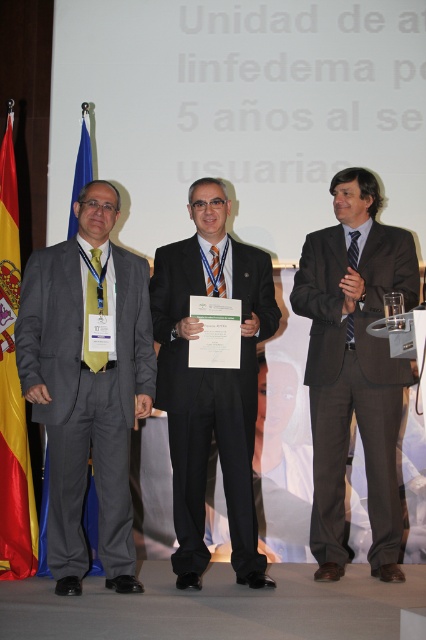
Question: Is matte gray suit at left positioned at the back of red fabric flag at left?

Choices:
 (A) yes
 (B) no

Answer: (B)

Question: Which point is closer to the camera?

Choices:
 (A) (181, 273)
 (B) (368, 314)
 (C) (20, 513)
 (D) (78, 406)

Answer: (D)

Question: Can you confirm if black suit at center is positioned above red fabric flag at left?

Choices:
 (A) no
 (B) yes

Answer: (A)

Question: Which point is closer to the camera?

Choices:
 (A) brown wool suit at center
 (B) red fabric flag at left
 (C) matte gray suit at left
 (D) black suit at center

Answer: (C)

Question: Which point appears farthest from the camera in this image?

Choices:
 (A) (13, 285)
 (B) (181, 342)

Answer: (A)

Question: Does brown wool suit at center appear on the right side of black suit at center?

Choices:
 (A) yes
 (B) no

Answer: (A)